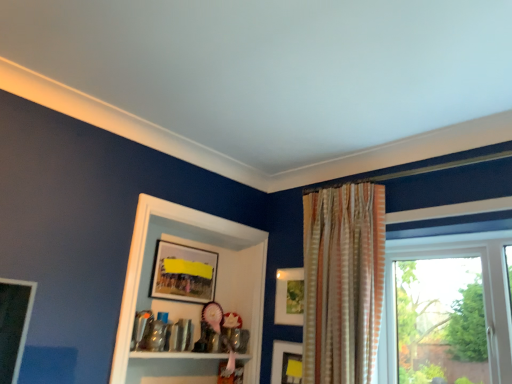
Question: Is matte yellow picture frame at lower right, marked as the first picture frame in a right-to-left arrangement, at the back of matte wooden picture frame at upper center, which is the first picture frame in left-to-right order?

Choices:
 (A) yes
 (B) no

Answer: (B)

Question: From a real-world perspective, is matte wooden picture frame at upper center, which is the first picture frame in left-to-right order, over matte yellow picture frame at lower right, marked as the first picture frame in a right-to-left arrangement?

Choices:
 (A) no
 (B) yes

Answer: (B)

Question: Is matte wooden picture frame at upper center, which is the 4th picture frame from right to left, smaller than matte yellow picture frame at lower right, the 4th picture frame positioned from the left?

Choices:
 (A) yes
 (B) no

Answer: (B)

Question: Can you confirm if matte wooden picture frame at upper center, which is the first picture frame in left-to-right order, is positioned to the right of matte yellow picture frame at lower right, the 4th picture frame positioned from the left?

Choices:
 (A) no
 (B) yes

Answer: (A)

Question: Is matte wooden picture frame at upper center, which is the 4th picture frame from right to left, behind matte yellow picture frame at lower right, marked as the first picture frame in a right-to-left arrangement?

Choices:
 (A) no
 (B) yes

Answer: (B)

Question: Does matte wooden picture frame at upper center, which is the first picture frame in left-to-right order, lie in front of matte yellow picture frame at lower right, the 4th picture frame positioned from the left?

Choices:
 (A) no
 (B) yes

Answer: (A)

Question: Does matte white picture frame at center, placed as the second picture frame when sorted from right to left, lie behind white glossy cabinet at center?

Choices:
 (A) no
 (B) yes

Answer: (B)

Question: Is matte white picture frame at center, the third picture frame from the left, aimed at white glossy cabinet at center?

Choices:
 (A) no
 (B) yes

Answer: (A)

Question: Is matte white picture frame at center, placed as the second picture frame when sorted from right to left, not within white glossy cabinet at center?

Choices:
 (A) yes
 (B) no

Answer: (A)

Question: Considering the relative sizes of matte white picture frame at center, placed as the second picture frame when sorted from right to left, and white glossy cabinet at center in the image provided, is matte white picture frame at center, placed as the second picture frame when sorted from right to left, smaller than white glossy cabinet at center?

Choices:
 (A) no
 (B) yes

Answer: (B)

Question: From the image's perspective, would you say matte white picture frame at center, the third picture frame from the left, is positioned over white glossy cabinet at center?

Choices:
 (A) no
 (B) yes

Answer: (A)

Question: Is matte white picture frame at center, the third picture frame from the left, with white glossy cabinet at center?

Choices:
 (A) yes
 (B) no

Answer: (B)

Question: Is the position of wooden picture frame at center, placed as the 2th picture frame when sorted from left to right, more distant than that of matte wooden picture frame at upper center, which is the first picture frame in left-to-right order?

Choices:
 (A) yes
 (B) no

Answer: (B)